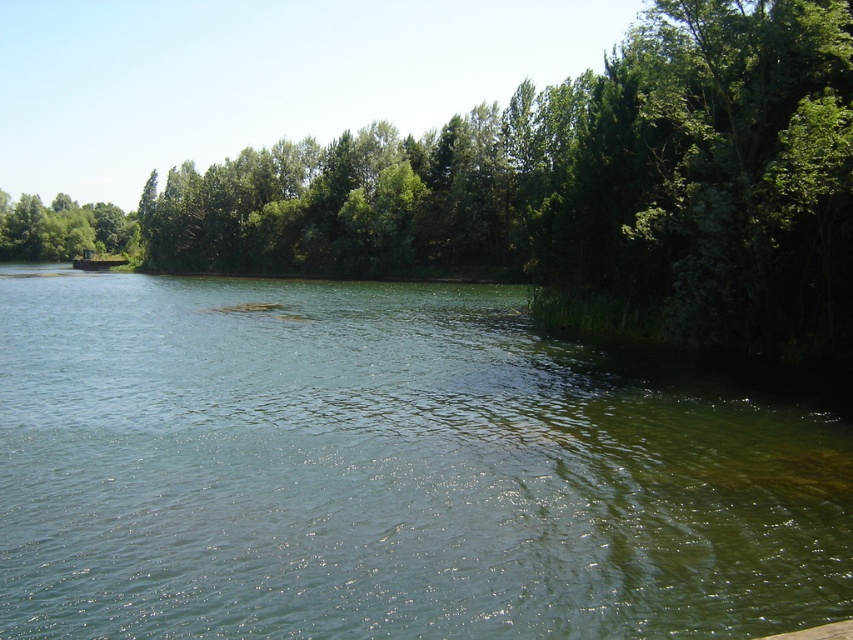
Question: Does green leafy tree at left have a lesser width compared to brown wooden dock at left?

Choices:
 (A) no
 (B) yes

Answer: (A)

Question: Which is farther from the green translucent water at center?

Choices:
 (A) green leafy tree at left
 (B) brown wooden dock at left
 (C) green leafy tree at center

Answer: (A)

Question: From the image, what is the correct spatial relationship of green leafy tree at center in relation to green leafy tree at left?

Choices:
 (A) above
 (B) below

Answer: (A)

Question: Which point is closer to the camera?

Choices:
 (A) green leafy tree at left
 (B) green translucent water at center

Answer: (B)

Question: Among these points, which one is nearest to the camera?

Choices:
 (A) (612, 152)
 (B) (26, 237)
 (C) (107, 260)
 (D) (780, 452)

Answer: (D)

Question: Is green translucent water at center positioned at the back of brown wooden dock at left?

Choices:
 (A) no
 (B) yes

Answer: (A)